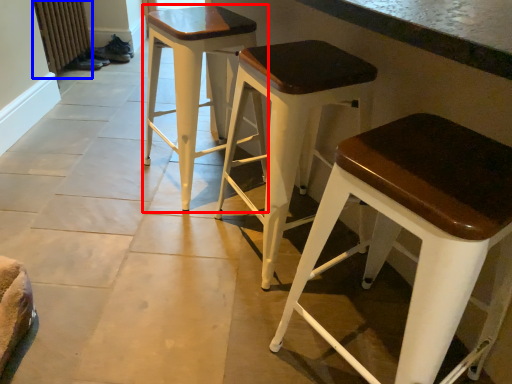
Question: Which point is closer to the camera, stool (highlighted by a red box) or radiator (highlighted by a blue box)?

Choices:
 (A) stool
 (B) radiator

Answer: (A)